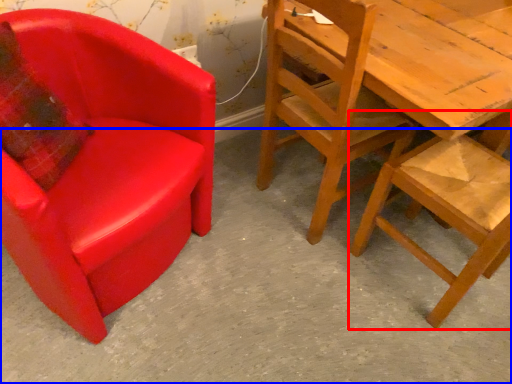
Question: Which object is further to the camera taking this photo, chair (highlighted by a red box) or concrete (highlighted by a blue box)?

Choices:
 (A) chair
 (B) concrete

Answer: (A)